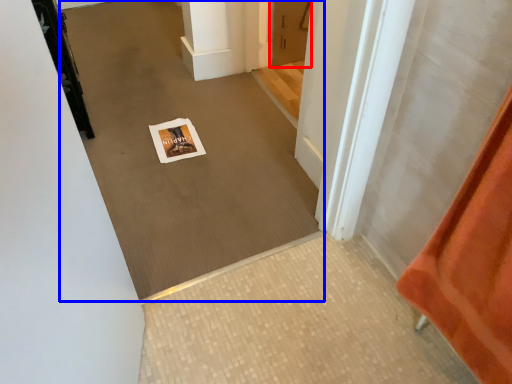
Question: Which of the following is the farthest to the observer, door (highlighted by a red box) or plain (highlighted by a blue box)?

Choices:
 (A) door
 (B) plain

Answer: (A)